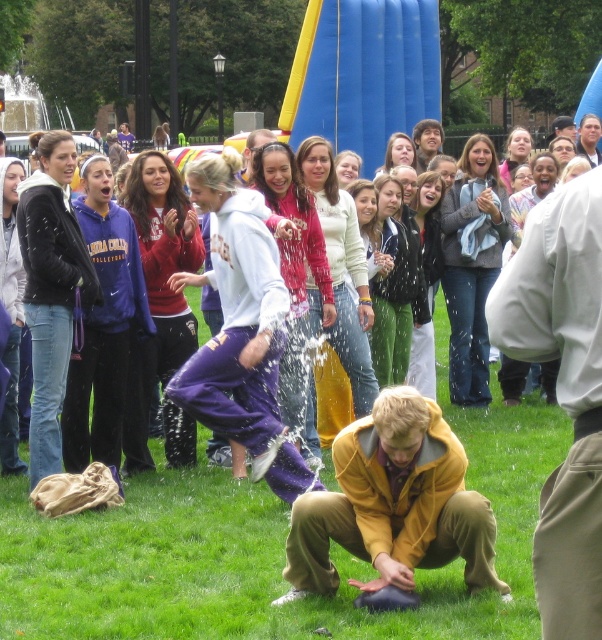
Question: Which object is closer to the camera taking this photo?

Choices:
 (A) smooth gray hoodie at upper right
 (B) green grass at lower center
 (C) light brown cotton pants at lower right
 (D) yellow matte jacket at lower center

Answer: (C)

Question: Which object appears farthest from the camera in this image?

Choices:
 (A) smooth white shirt at upper right
 (B) smooth brown hair at upper center
 (C) yellow matte jacket at lower center
 (D) smooth gray hoodie at upper right

Answer: (A)

Question: Can you confirm if smooth brown hair at upper center is positioned above smooth white shirt at upper right?

Choices:
 (A) yes
 (B) no

Answer: (B)

Question: Does light brown cotton pants at lower right appear on the right side of smooth white shirt at upper right?

Choices:
 (A) no
 (B) yes

Answer: (A)

Question: Which object is positioned closest to the green grass at lower center?

Choices:
 (A) light brown cotton pants at lower right
 (B) smooth white shirt at upper right
 (C) smooth brown hair at upper center

Answer: (A)

Question: Does yellow matte jacket at lower center appear on the right side of smooth brown hair at upper center?

Choices:
 (A) yes
 (B) no

Answer: (B)